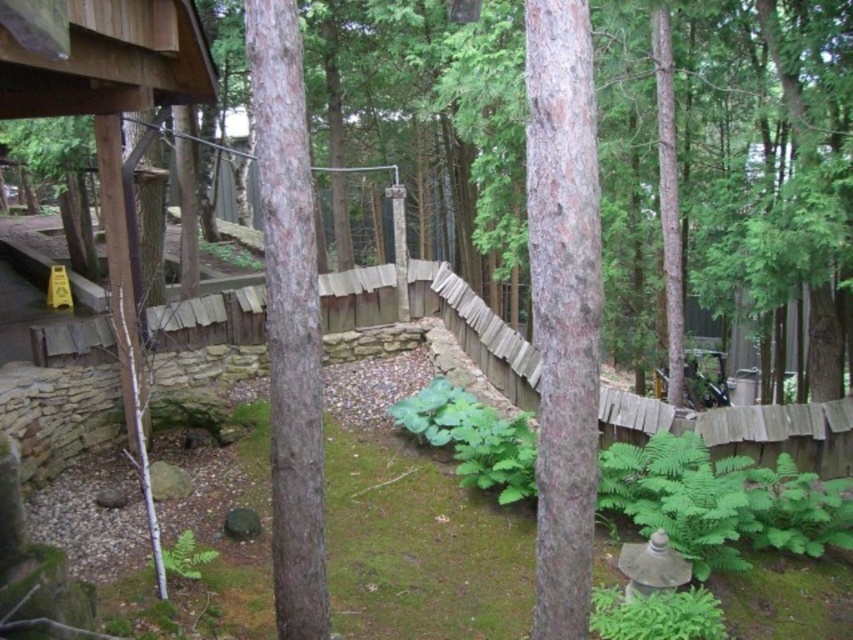
You are a gardener trying to determine which tree trunk is narrower between the smooth brown tree trunk at center and the brown rough bark tree at center. Based on the scene, which one should you choose?

The smooth brown tree trunk at center has a lesser width compared to the brown rough bark tree at center, so you should choose the smooth brown tree trunk at center.

You are designing a garden path that needs to pass between the smooth brown tree trunk at center and the brown rough bark tree at center. Which tree should the path be closer to if you want to avoid the larger tree?

The path should be closer to the smooth brown tree trunk at center because it is smaller in size compared to the brown rough bark tree at center, allowing more space to avoid the larger tree.

You are standing in the garden and want to touch both the smooth brown tree trunk at center and the brown rough bark tree at center. Which tree trunk will you reach first?

The smooth brown tree trunk at center is closer to the viewer than the brown rough bark tree at center, so you will reach the smooth brown tree trunk at center first.